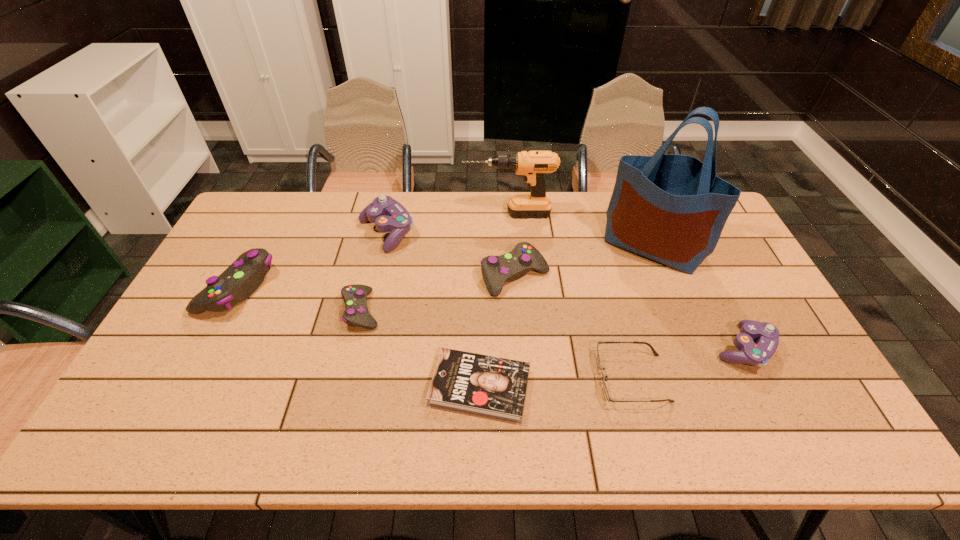
At what (x,y) coordinates should I click in order to perform the action: click on control that is at the far edge. Please return your answer as a coordinate pair (x, y). This screenshot has width=960, height=540. Looking at the image, I should click on (389, 215).

Where is `object that is positioned at the near edge`? Image resolution: width=960 pixels, height=540 pixels. object that is positioned at the near edge is located at coordinates (494, 387).

Locate an element on the screen. object that is at the left edge is located at coordinates (241, 279).

At what (x,y) coordinates should I click in order to perform the action: click on handbag that is at the right edge. Please return your answer as a coordinate pair (x, y). The width and height of the screenshot is (960, 540). Looking at the image, I should click on (670, 208).

Locate an element on the screen. The height and width of the screenshot is (540, 960). control that is positioned at the right edge is located at coordinates (756, 354).

Where is `object that is at the far right corner`? The image size is (960, 540). object that is at the far right corner is located at coordinates (670, 208).

Image resolution: width=960 pixels, height=540 pixels. In order to click on vacant area at the far edge of the desktop in this screenshot , I will do `click(564, 202)`.

Identify the location of vacant space at the left edge. (230, 314).

This screenshot has height=540, width=960. In order to click on vacant space at the right edge of the desktop in this screenshot , I will do `click(729, 236)`.

Locate an element on the screen. This screenshot has width=960, height=540. free space at the far left corner of the desktop is located at coordinates (270, 226).